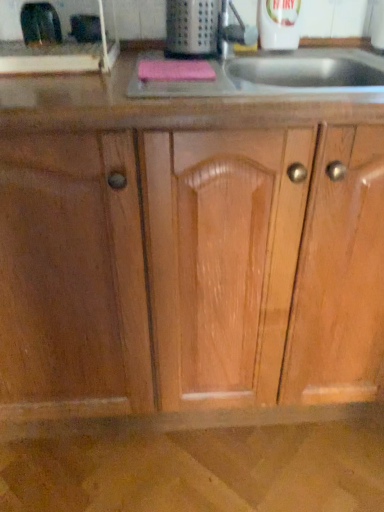
Question: Does metallic silver toaster at upper left, the second appliance from the left, have a larger size compared to pink fabric sponge at upper center?

Choices:
 (A) no
 (B) yes

Answer: (A)

Question: From the image's perspective, is metallic silver toaster at upper left, the second appliance from the left, above pink fabric sponge at upper center?

Choices:
 (A) no
 (B) yes

Answer: (B)

Question: Is metallic silver toaster at upper left, the second appliance from the left, located outside pink fabric sponge at upper center?

Choices:
 (A) no
 (B) yes

Answer: (B)

Question: From the image's perspective, does metallic silver toaster at upper left, the second appliance from the left, appear lower than pink fabric sponge at upper center?

Choices:
 (A) yes
 (B) no

Answer: (B)

Question: Considering the relative sizes of metallic silver toaster at upper left, which appears as the 2th appliance when viewed from the right, and pink fabric sponge at upper center in the image provided, is metallic silver toaster at upper left, which appears as the 2th appliance when viewed from the right, wider than pink fabric sponge at upper center?

Choices:
 (A) yes
 (B) no

Answer: (B)

Question: Could pink fabric sponge at upper center be considered to be inside metallic silver toaster at upper left, which appears as the 2th appliance when viewed from the right?

Choices:
 (A) yes
 (B) no

Answer: (B)

Question: Is pink fabric sponge at upper center wider than metallic silver toaster at upper left, which appears as the 2th appliance when viewed from the right?

Choices:
 (A) no
 (B) yes

Answer: (B)

Question: Is pink fabric sponge at upper center at the right side of metallic silver toaster at upper left, the second appliance from the left?

Choices:
 (A) no
 (B) yes

Answer: (B)

Question: Considering the relative sizes of pink fabric sponge at upper center and metallic silver toaster at upper left, which appears as the 2th appliance when viewed from the right, in the image provided, is pink fabric sponge at upper center shorter than metallic silver toaster at upper left, which appears as the 2th appliance when viewed from the right,?

Choices:
 (A) no
 (B) yes

Answer: (B)

Question: Can you confirm if pink fabric sponge at upper center is taller than metallic silver toaster at upper left, the second appliance from the left?

Choices:
 (A) no
 (B) yes

Answer: (A)

Question: Considering the relative positions of pink fabric sponge at upper center and metallic silver toaster at upper left, the second appliance from the left, in the image provided, is pink fabric sponge at upper center to the left of metallic silver toaster at upper left, the second appliance from the left, from the viewer's perspective?

Choices:
 (A) no
 (B) yes

Answer: (A)

Question: Can you confirm if pink fabric sponge at upper center is thinner than metallic silver toaster at upper left, which appears as the 2th appliance when viewed from the right?

Choices:
 (A) no
 (B) yes

Answer: (A)

Question: Is there a large distance between black rubber gloves at upper left, the 3th appliance viewed from the right, and metallic silver toaster at upper left, which appears as the 2th appliance when viewed from the right?

Choices:
 (A) yes
 (B) no

Answer: (B)